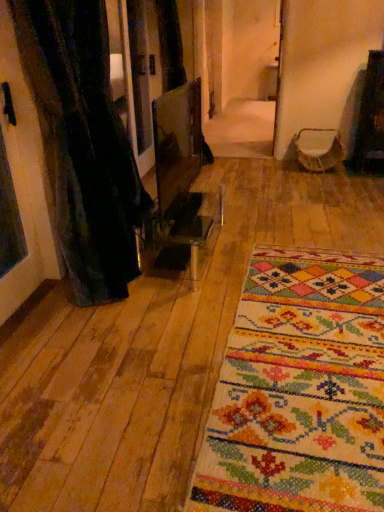
Question: Is velvet-like beige armchair at center outside of multicolored woven rug at center?

Choices:
 (A) no
 (B) yes

Answer: (B)

Question: From the image's perspective, does velvet-like beige armchair at center appear lower than multicolored woven rug at center?

Choices:
 (A) yes
 (B) no

Answer: (B)

Question: Is velvet-like beige armchair at center not close to multicolored woven rug at center?

Choices:
 (A) no
 (B) yes

Answer: (B)

Question: Can you confirm if velvet-like beige armchair at center is thinner than multicolored woven rug at center?

Choices:
 (A) yes
 (B) no

Answer: (A)

Question: Could multicolored woven rug at center be considered to be inside velvet-like beige armchair at center?

Choices:
 (A) yes
 (B) no

Answer: (B)

Question: Considering the positions of multicolored woven rug at center and black textured curtain at left in the image, is multicolored woven rug at center bigger or smaller than black textured curtain at left?

Choices:
 (A) big
 (B) small

Answer: (B)

Question: Looking at their shapes, would you say multicolored woven rug at center is wider or thinner than black textured curtain at left?

Choices:
 (A) thin
 (B) wide

Answer: (B)

Question: From the image's perspective, is multicolored woven rug at center above or below black textured curtain at left?

Choices:
 (A) above
 (B) below

Answer: (B)

Question: Is multicolored woven rug at center inside or outside of black textured curtain at left?

Choices:
 (A) outside
 (B) inside

Answer: (A)

Question: Is black textured curtain at left spatially inside multicolored woven rug at center, or outside of it?

Choices:
 (A) outside
 (B) inside

Answer: (A)

Question: Considering the positions of black textured curtain at left and multicolored woven rug at center in the image, is black textured curtain at left wider or thinner than multicolored woven rug at center?

Choices:
 (A) thin
 (B) wide

Answer: (A)

Question: Is black textured curtain at left in front of or behind multicolored woven rug at center in the image?

Choices:
 (A) behind
 (B) front

Answer: (A)

Question: From a real-world perspective, is black textured curtain at left physically located above or below multicolored woven rug at center?

Choices:
 (A) below
 (B) above

Answer: (B)

Question: Choose the correct answer: Is velvet-like beige armchair at center inside black textured curtain at left or outside it?

Choices:
 (A) outside
 (B) inside

Answer: (A)

Question: Considering the positions of point (339, 146) and point (43, 101), is point (339, 146) closer or farther from the camera than point (43, 101)?

Choices:
 (A) closer
 (B) farther

Answer: (B)